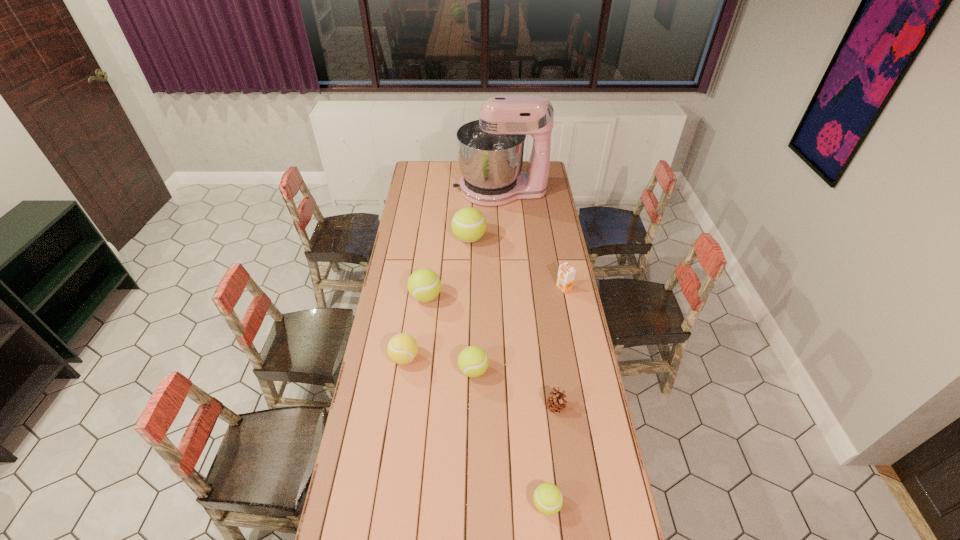
The image size is (960, 540). What are the coordinates of `the tallest object` in the screenshot? It's located at (490, 150).

Identify the location of pink mixer. (490, 150).

At what (x,y) coordinates should I click in order to perform the action: click on the seventh nearest object. Please return your answer as a coordinate pair (x, y). The height and width of the screenshot is (540, 960). Looking at the image, I should click on (468, 224).

The width and height of the screenshot is (960, 540). In order to click on the farthest green tennis ball in this screenshot , I will do `click(468, 224)`.

Locate an element on the screen. The height and width of the screenshot is (540, 960). the leftmost green tennis ball is located at coordinates (424, 285).

Where is `the fourth nearest tennis ball`? the fourth nearest tennis ball is located at coordinates click(424, 285).

I want to click on orange orange juice, so [566, 273].

Locate an element on the screen. Image resolution: width=960 pixels, height=540 pixels. yellow tennis ball is located at coordinates (402, 348).

Locate an element on the screen. This screenshot has height=540, width=960. the second smallest green tennis ball is located at coordinates (473, 361).

Where is `pinecone`? pinecone is located at coordinates (555, 402).